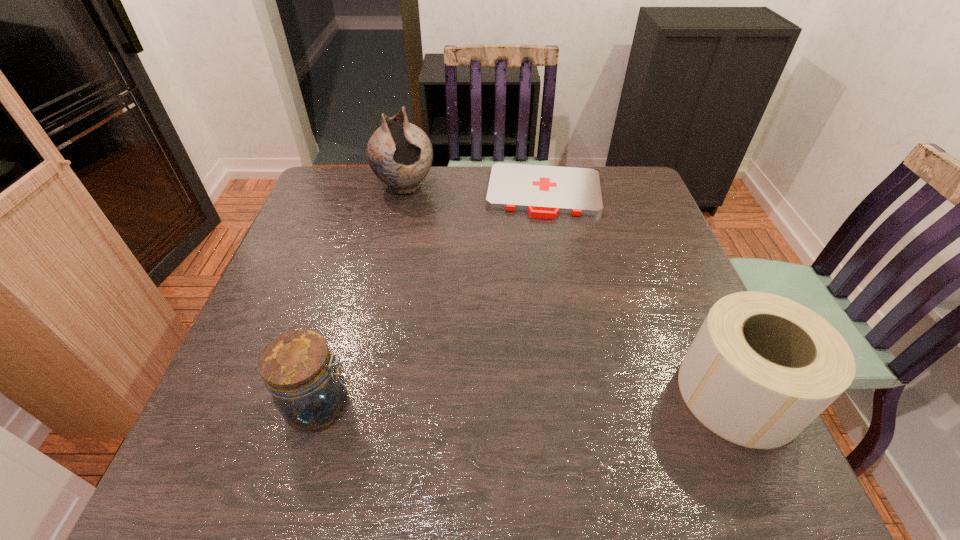
Locate an element on the screen. jar is located at coordinates (298, 369).

Where is `toilet tissue`? The height and width of the screenshot is (540, 960). toilet tissue is located at coordinates (762, 367).

Find the location of `the tallest object`. the tallest object is located at coordinates (400, 154).

Identify the location of the first-aid kit. (544, 191).

The image size is (960, 540). I want to click on the second object from right to left, so click(544, 191).

Where is `free spot located on the lid of the jar`? The image size is (960, 540). free spot located on the lid of the jar is located at coordinates (450, 405).

Find the location of a particular element. The width and height of the screenshot is (960, 540). free space located 0.130m on the left of the rightmost object is located at coordinates (614, 393).

Where is `free region located from the spout of the pottery`? The height and width of the screenshot is (540, 960). free region located from the spout of the pottery is located at coordinates tap(444, 269).

Locate an element on the screen. The width and height of the screenshot is (960, 540). free space located 0.380m from the spout of the pottery is located at coordinates (453, 291).

Where is `vacant space located 0.070m from the spout of the pottery`? vacant space located 0.070m from the spout of the pottery is located at coordinates pyautogui.click(x=419, y=217).